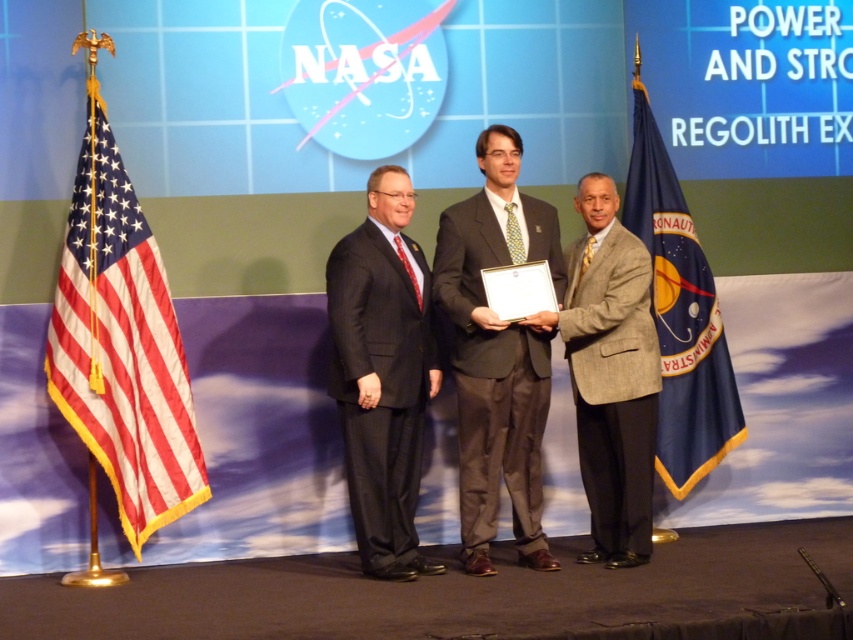
Question: Among these points, which one is nearest to the camera?

Choices:
 (A) (737, 392)
 (B) (171, 465)
 (C) (434, 244)

Answer: (B)

Question: Is red-white-blue fabric flag at left to the left of light brown textured suit at center from the viewer's perspective?

Choices:
 (A) no
 (B) yes

Answer: (B)

Question: Can you confirm if red-white-blue fabric flag at left is positioned to the right of dark gray suit at center?

Choices:
 (A) yes
 (B) no

Answer: (B)

Question: Which is farther from the dark gray suit at center?

Choices:
 (A) red-white-blue fabric flag at left
 (B) blue fabric flag at right
 (C) matte gray suit at center
 (D) light brown textured suit at center

Answer: (B)

Question: Which object is closer to the camera taking this photo?

Choices:
 (A) blue fabric flag at right
 (B) matte gray suit at center
 (C) dark gray suit at center
 (D) red-white-blue fabric flag at left

Answer: (C)

Question: Is light brown textured suit at center smaller than blue fabric flag at right?

Choices:
 (A) yes
 (B) no

Answer: (A)